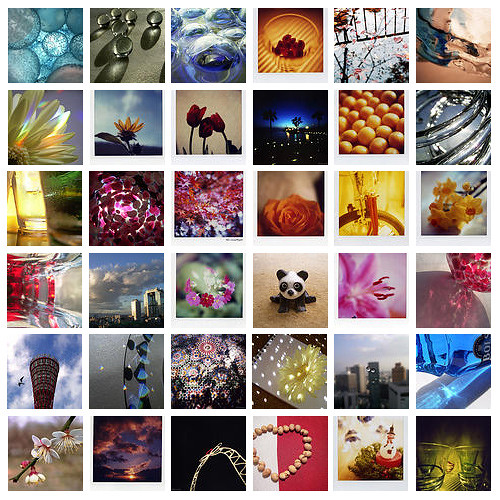
Where is `boxes in far left column`? This screenshot has height=500, width=500. boxes in far left column is located at coordinates (45, 460), (58, 368), (51, 288), (48, 216), (31, 136), (26, 66).